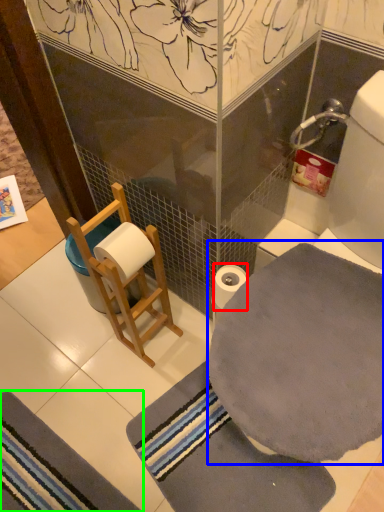
Question: Considering the real-world distances, which object is farthest from toilet paper (highlighted by a red box)? bath towel (highlighted by a blue box) or bath mat (highlighted by a green box)?

Choices:
 (A) bath towel
 (B) bath mat

Answer: (B)